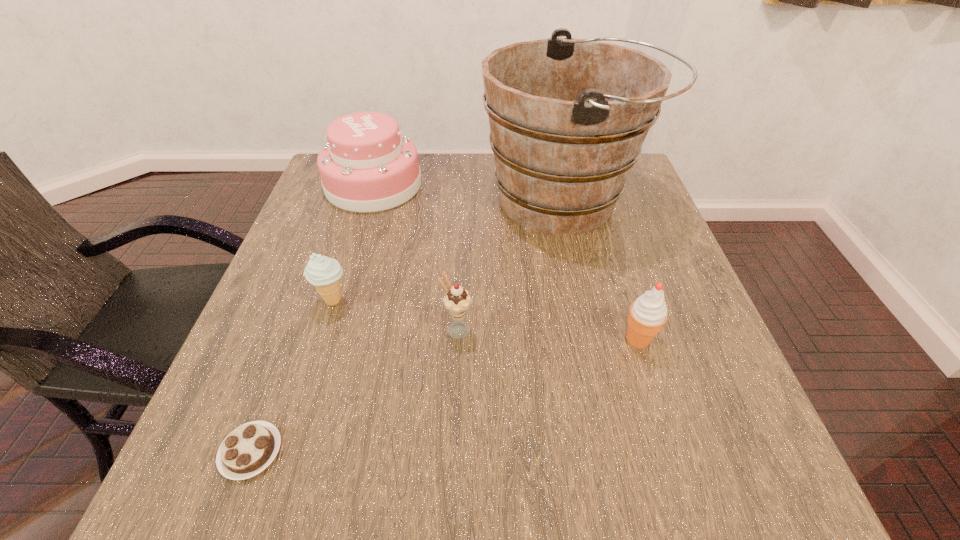
Locate an element on the screen. Image resolution: width=960 pixels, height=540 pixels. vacant point located between the bucket and the rightmost icecream is located at coordinates (602, 271).

At what (x,y) coordinates should I click in order to perform the action: click on free spot between the chocolate cake and the cake. Please return your answer as a coordinate pair (x, y). The width and height of the screenshot is (960, 540). Looking at the image, I should click on (312, 318).

Find the location of `free space that is in between the leftmost icecream and the tallest object`. free space that is in between the leftmost icecream and the tallest object is located at coordinates (449, 251).

At what (x,y) coordinates should I click in order to perform the action: click on empty location between the shortest object and the tallest object. Please return your answer as a coordinate pair (x, y). Looking at the image, I should click on (408, 326).

This screenshot has width=960, height=540. In order to click on free area in between the second icecream from right to left and the bucket in this screenshot , I will do `click(511, 266)`.

I want to click on free spot between the rightmost icecream and the third farthest object, so click(486, 320).

This screenshot has width=960, height=540. I want to click on empty location between the cake and the bucket, so click(x=469, y=193).

Locate an element on the screen. Image resolution: width=960 pixels, height=540 pixels. empty space between the bucket and the cake is located at coordinates (469, 193).

Select which object appears as the closest to the shortest object. Please provide its 2D coordinates. Your answer should be formatted as a tuple, i.e. [(x, y)], where the tuple contains the x and y coordinates of a point satisfying the conditions above.

[(323, 272)]

Choose which object is the fifth nearest neighbor to the rightmost icecream. Please provide its 2D coordinates. Your answer should be formatted as a tuple, i.e. [(x, y)], where the tuple contains the x and y coordinates of a point satisfying the conditions above.

[(250, 448)]